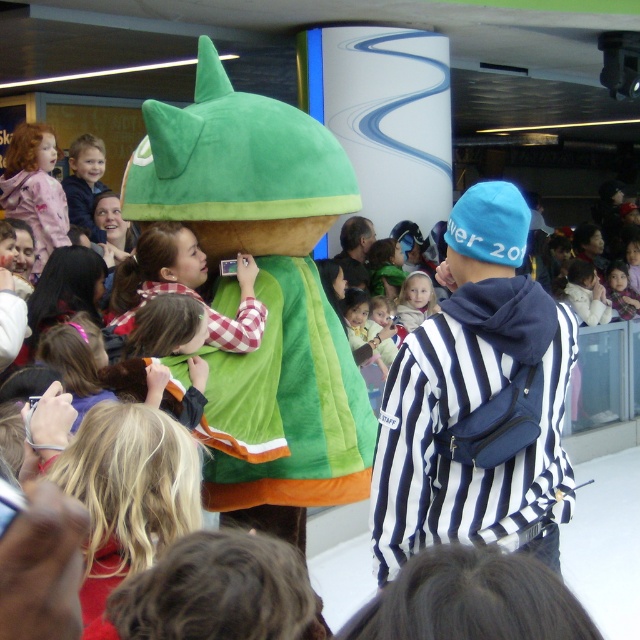
You are a photographer at the event and need to capture both the blue fleece beanie at upper right and the smooth beige shirt at center in a single shot. Based on their positions, which object should you position closer to the left side of your camera frame?

The blue fleece beanie at upper right is to the left of the smooth beige shirt at center, so to include both in the frame, position the blue fleece beanie at upper right closer to the left side of your camera frame.

You are standing at the center of the scene and want to find the blue fleece beanie at upper right. Which direction should you look to locate it?

The blue fleece beanie at upper right is located at point (477, 401), so you should look towards the upper right direction to find it.